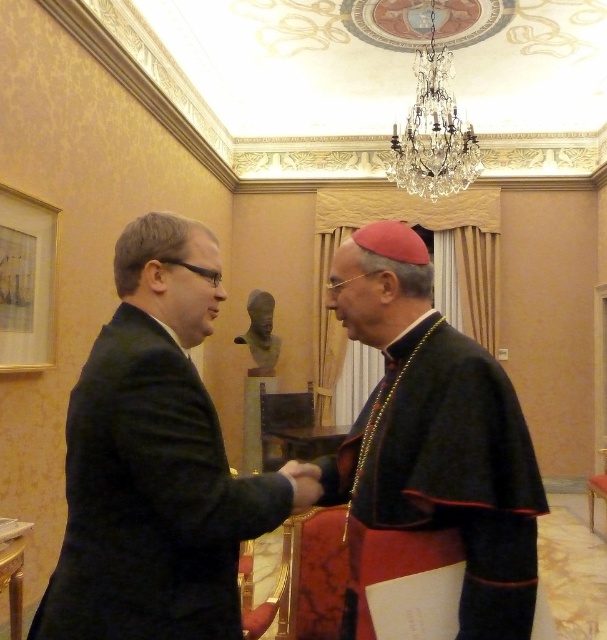
Can you confirm if black velvet robe at center is thinner than velvet black robe at left?

Indeed, black velvet robe at center has a lesser width compared to velvet black robe at left.

Between black velvet robe at center and velvet black robe at left, which one has less height?

velvet black robe at left

Measure the distance between point (475, 637) and camera.

The distance of point (475, 637) from camera is 1.24 meters.

Locate an element on the screen. black velvet robe at center is located at coordinates click(429, 449).